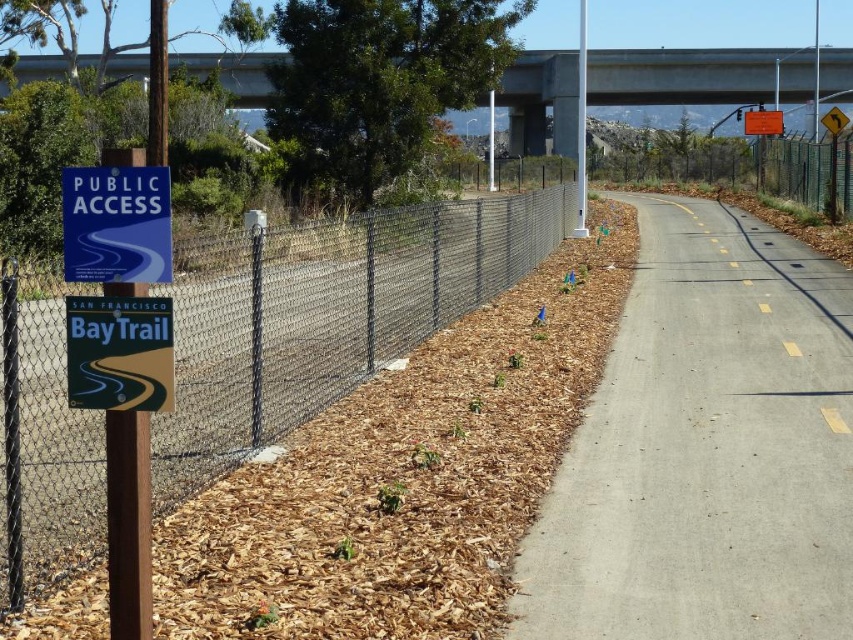
Question: Does concrete at upper center lie in front of blue plastic sign at left?

Choices:
 (A) yes
 (B) no

Answer: (B)

Question: Estimate the real-world distances between objects in this image. Which object is closer to the green chain-link fence at upper right?

Choices:
 (A) concrete at upper center
 (B) chain link fence at left

Answer: (B)

Question: Does gray asphalt road at center have a larger size compared to green chain-link fence at upper right?

Choices:
 (A) yes
 (B) no

Answer: (B)

Question: Estimate the real-world distances between objects in this image. Which object is closer to the gray asphalt road at center?

Choices:
 (A) blue plastic sign at left
 (B) green chain-link fence at upper right

Answer: (A)

Question: Which object is positioned farthest from the chain link fence at left?

Choices:
 (A) green chain-link fence at upper right
 (B) concrete at upper center

Answer: (B)

Question: Considering the relative positions of gray asphalt road at center and chain link fence at left in the image provided, where is gray asphalt road at center located with respect to chain link fence at left?

Choices:
 (A) right
 (B) left

Answer: (A)